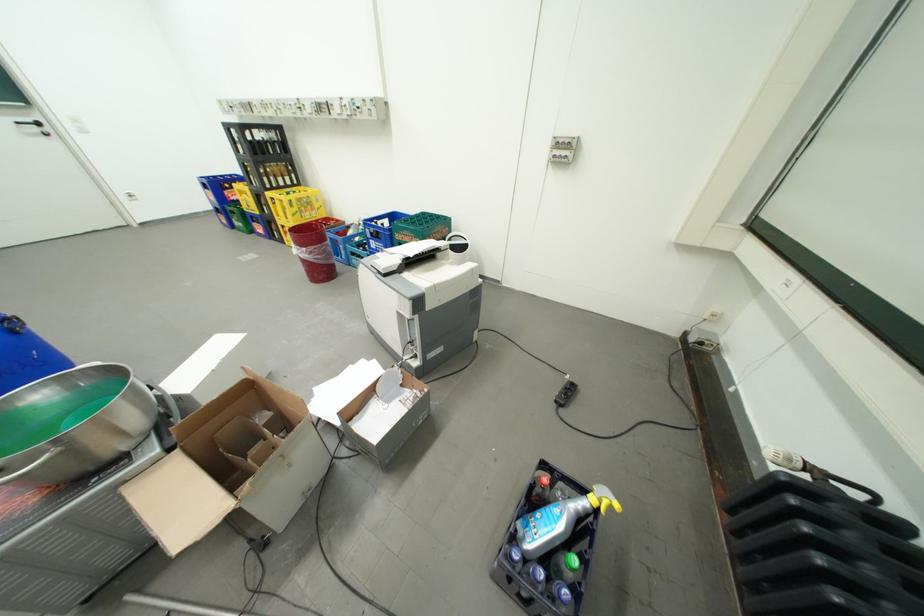
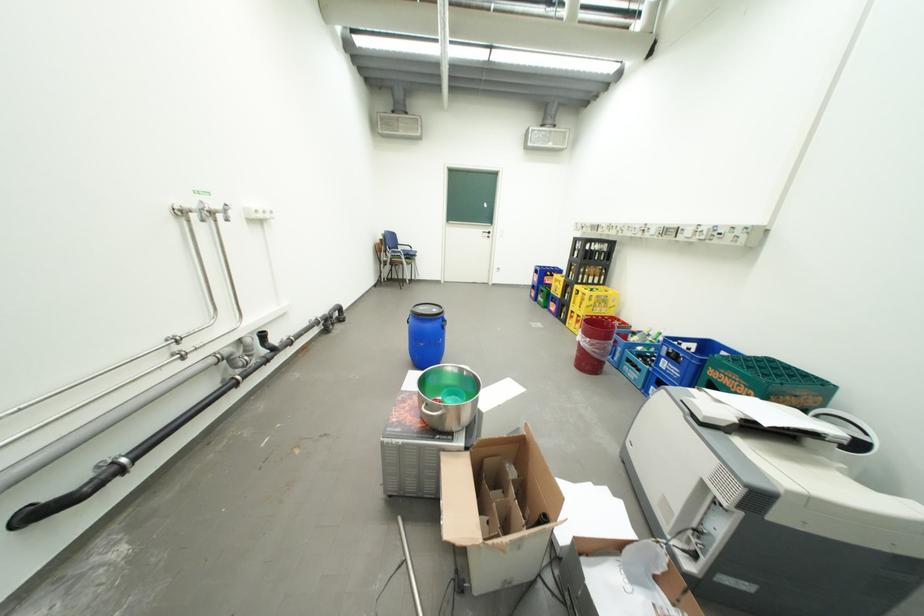
Locate, in the second image, the point that corresponds to the point at 314,249 in the first image.

(599, 341)